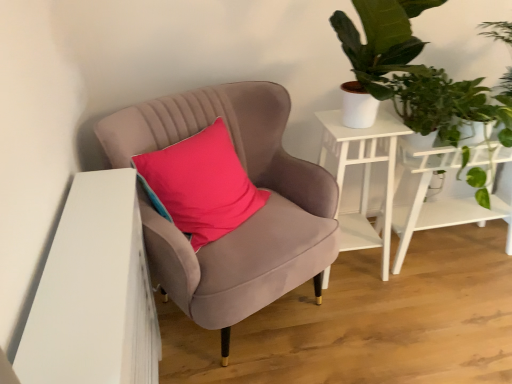
Locate an element on the screen. The width and height of the screenshot is (512, 384). vacant space underneath white matte table at right, positioned as the second table in left-to-right order (from a real-world perspective) is located at coordinates (444, 249).